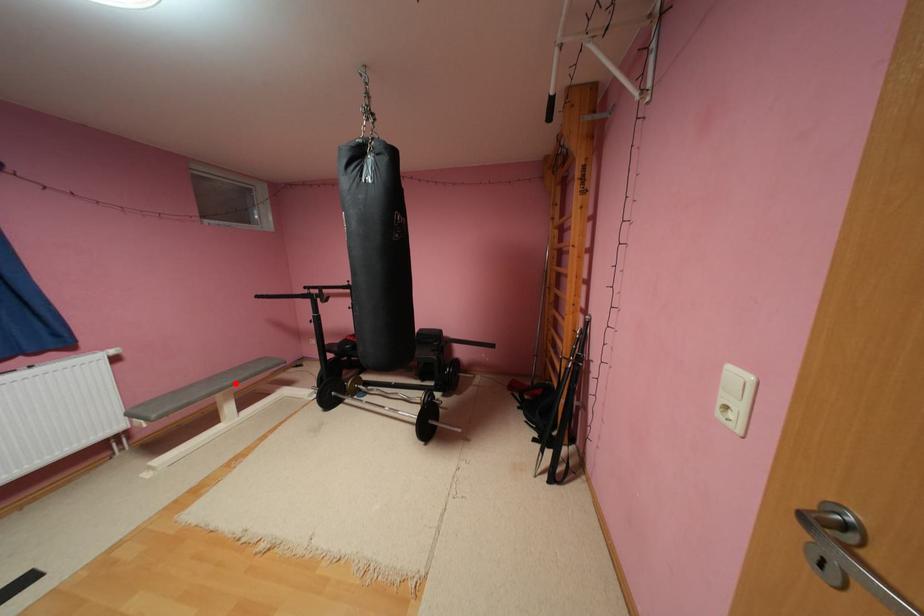
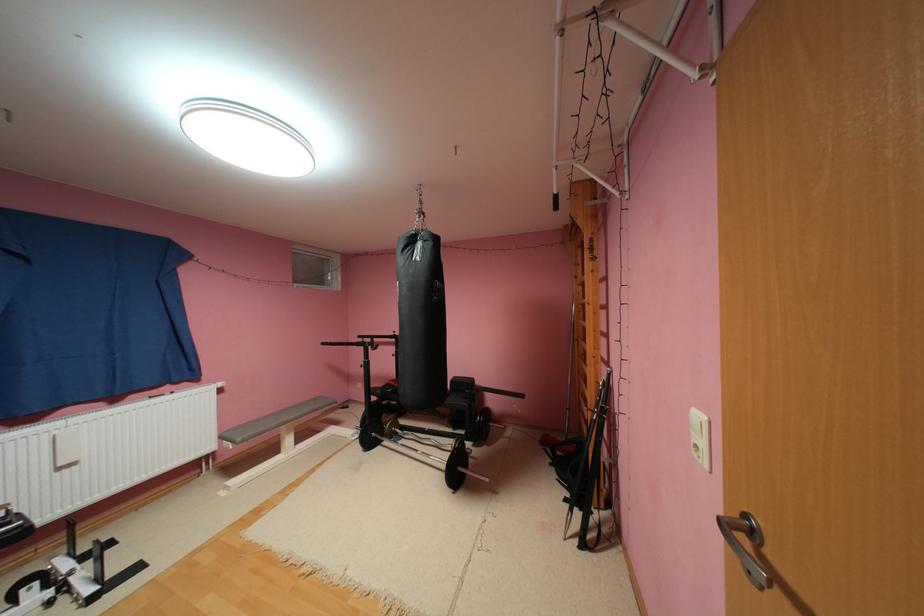
The point at the highlighted location is marked in the first image. Where is the corresponding point in the second image?

(300, 416)